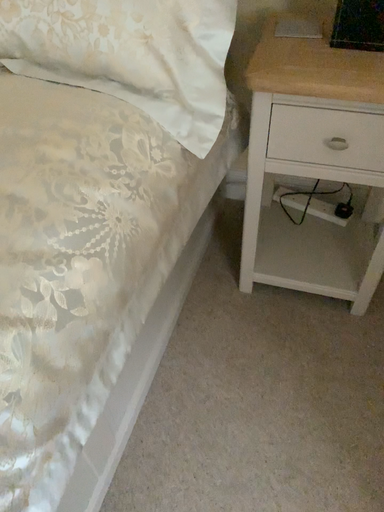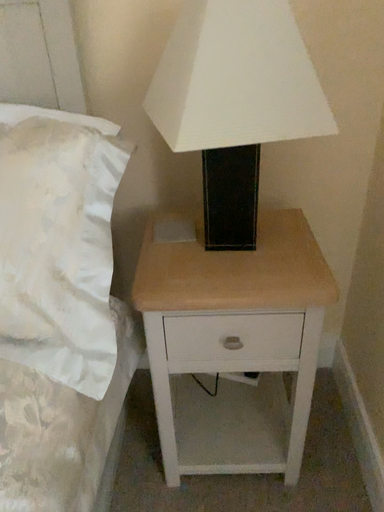
Question: How did the camera likely rotate when shooting the video?

Choices:
 (A) rotated right
 (B) rotated left

Answer: (A)